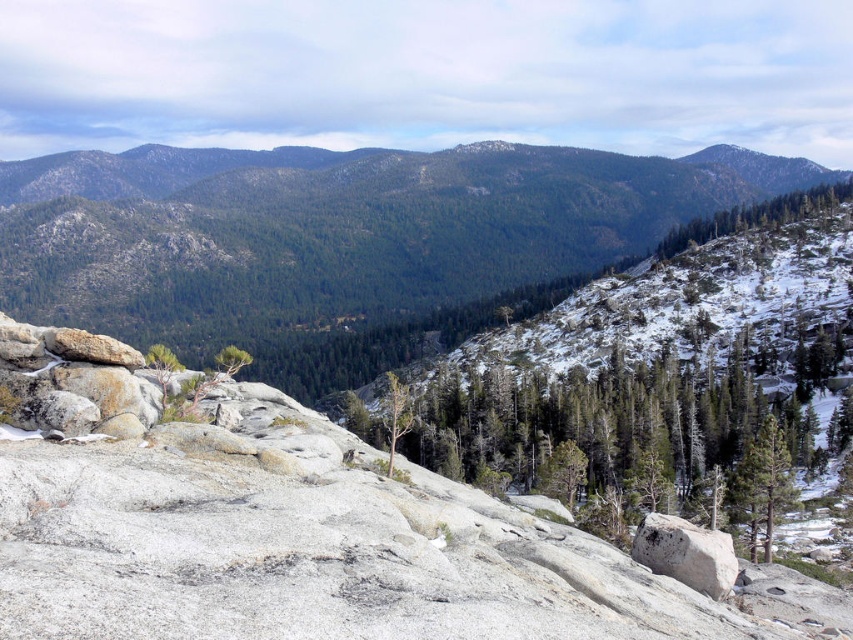
Consider the image. You are a hiker planning to cross the rocky terrain at center and the gray rough rock at center. Which path would require more climbing effort due to elevation differences?

The rocky terrain at center requires more climbing effort because it has a greater height compared to the gray rough rock at center.

Based on the photo, you are a hiker planning to cross the rocky terrain at center and the gray rough rock at center. Which path would you choose if you want to walk on the wider surface?

You should choose the rocky terrain at center because it might be wider than the gray rough rock at center.